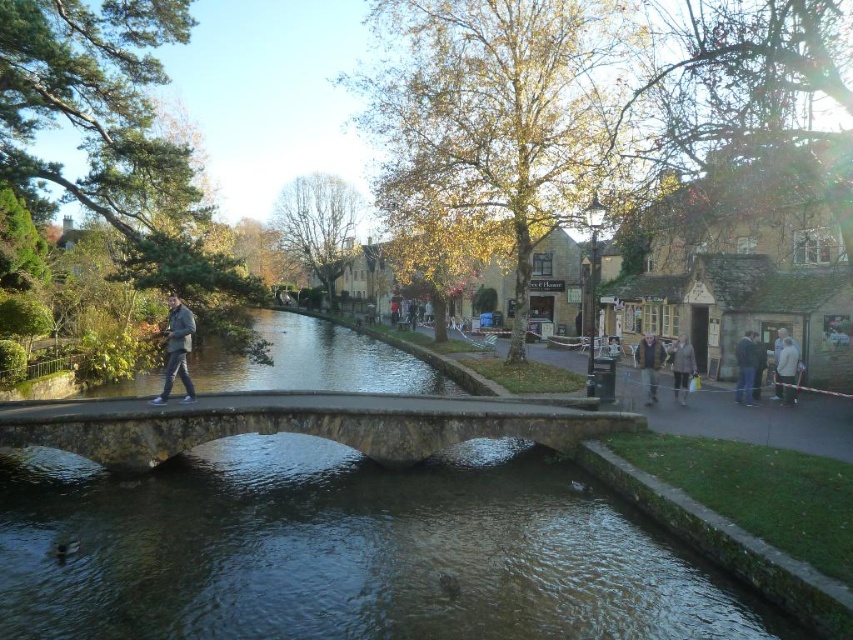
Question: Is blue denim jeans at right positioned behind white woolen sweater at center-right?

Choices:
 (A) no
 (B) yes

Answer: (B)

Question: Among these objects, which one is farthest from the camera?

Choices:
 (A) dark gray jacket at center
 (B) white woolen sweater at center-right
 (C) light brown leather jacket at lower right

Answer: (C)

Question: Which point is closer to the camera taking this photo?

Choices:
 (A) (682, 387)
 (B) (172, 340)
 (C) (753, 365)

Answer: (B)

Question: Is blue denim jeans at right positioned behind white woolen sweater at center-right?

Choices:
 (A) yes
 (B) no

Answer: (A)

Question: Which point is closer to the camera?

Choices:
 (A) (756, 390)
 (B) (497, 417)
 (C) (662, 349)
 (D) (784, 388)

Answer: (B)

Question: Is dark gray jacket at center smaller than dark green jacket at right?

Choices:
 (A) yes
 (B) no

Answer: (A)